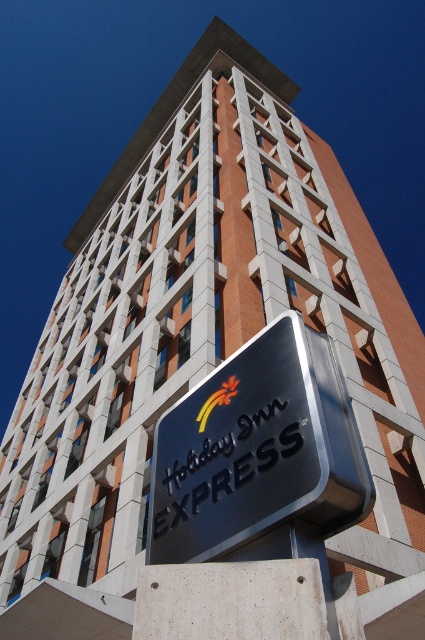
Question: Which of the following is the closest to the observer?

Choices:
 (A) metallic silver sign at center
 (B) yellowmaterial/texturelogo at lower center

Answer: (A)

Question: Does metallic silver sign at center have a larger size compared to yellowmaterial/texturelogo at lower center?

Choices:
 (A) no
 (B) yes

Answer: (B)

Question: Does metallic silver sign at center have a smaller size compared to yellowmaterial/texturelogo at lower center?

Choices:
 (A) no
 (B) yes

Answer: (A)

Question: Which point is farther to the camera?

Choices:
 (A) (274, 488)
 (B) (201, 412)

Answer: (B)

Question: Is the position of metallic silver sign at center more distant than that of yellowmaterial/texturelogo at lower center?

Choices:
 (A) yes
 (B) no

Answer: (B)